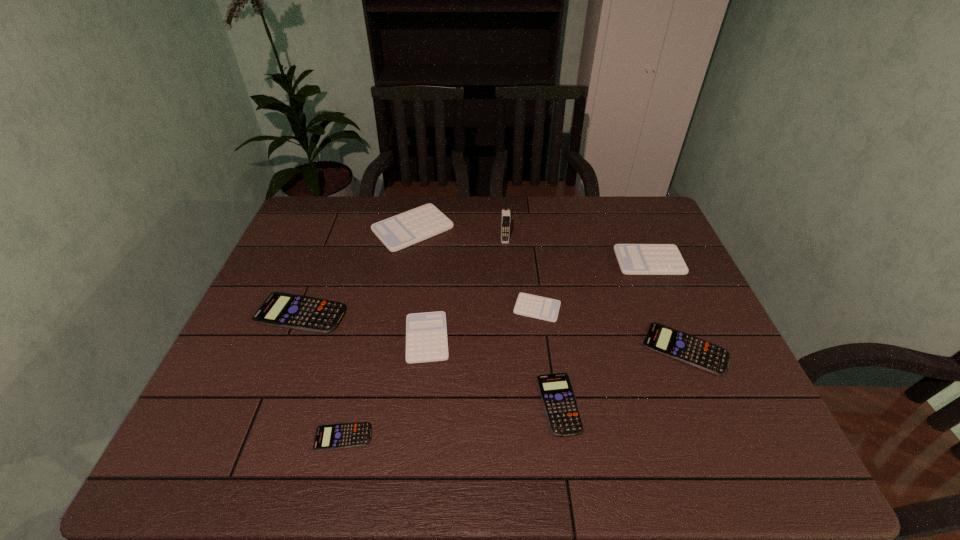
Find the location of a particular element. the third blue calculator from left to right is located at coordinates (562, 412).

Locate an element on the screen. This screenshot has height=540, width=960. the seventh tallest calculator is located at coordinates (562, 412).

Identify the location of the third blue calculator from right to left. (357, 434).

I want to click on the shortest object, so click(x=357, y=434).

Identify the location of free region located 0.290m on the front-facing side of the tallest object. (510, 312).

The image size is (960, 540). Find the location of `free space located 0.290m on the front of the tallest calculator`. free space located 0.290m on the front of the tallest calculator is located at coordinates (396, 325).

Where is `vacant space located 0.220m on the back of the third smallest white calculator`? The image size is (960, 540). vacant space located 0.220m on the back of the third smallest white calculator is located at coordinates (626, 208).

At what (x,y) coordinates should I click in order to perform the action: click on free space located on the back of the third biggest white calculator. Please return your answer as a coordinate pair (x, y). Looking at the image, I should click on (440, 227).

Identify the location of vacant area located 0.170m on the right of the leftmost object. The width and height of the screenshot is (960, 540). (410, 313).

Locate an element on the screen. This screenshot has width=960, height=540. vacant region located 0.070m on the back of the third white calculator from left to right is located at coordinates (533, 278).